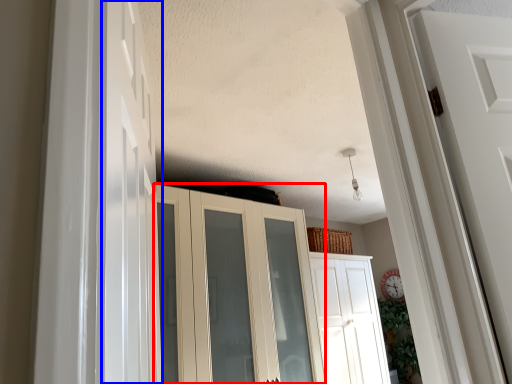
Question: Among these objects, which one is nearest to the camera, cupboard (highlighted by a red box) or door (highlighted by a blue box)?

Choices:
 (A) cupboard
 (B) door

Answer: (B)